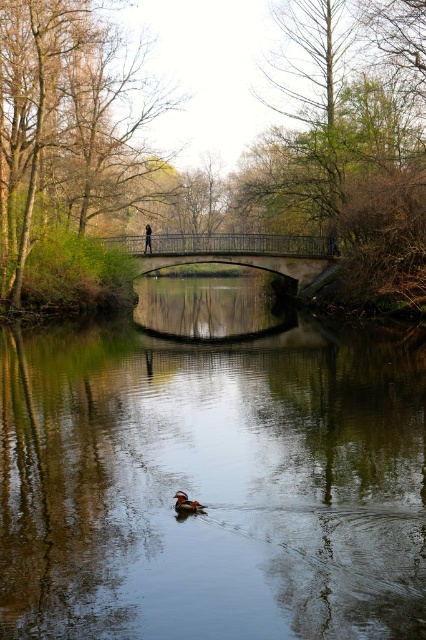
Is green leafy tree at upper center above green leafy tree at upper left?

Yes.

Who is more distant from viewer, (x=391, y=88) or (x=14, y=74)?

Positioned behind is point (x=391, y=88).

Is point (212, 212) closer to camera compared to point (137, 88)?

No, it is not.

In order to click on green leafy tree at upper center in this screenshot , I will do pos(215,161).

Is point (123, 148) behind point (298, 260)?

Yes, point (123, 148) is farther from viewer.

Is green leafy tree at upper center positioned before stone bridge at center?

Yes.

Between point (351, 33) and point (308, 268), which one is positioned behind?

Positioned behind is point (308, 268).

What are the coordinates of `green leafy tree at upper center` in the screenshot? It's located at 215,161.

Does green leafy tree at upper center appear on the left side of orange-brown wood duck at center?

Indeed, green leafy tree at upper center is positioned on the left side of orange-brown wood duck at center.

Is green leafy tree at upper center wider than orange-brown wood duck at center?

Indeed, green leafy tree at upper center has a greater width compared to orange-brown wood duck at center.

Which is in front, point (89, 170) or point (186, 508)?

Point (186, 508) is in front.

The width and height of the screenshot is (426, 640). Identify the location of green leafy tree at upper center. (215, 161).